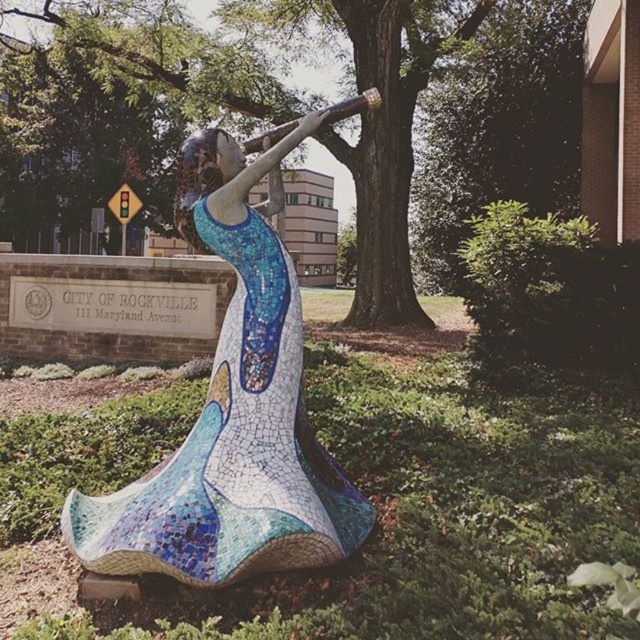
You are a visitor at the park and want to take a photo of the mosaic tile woman at center and the green leafy tree at center. Which object should you focus on first if you want to capture both in the same frame without moving the camera?

The mosaic tile woman at center is smaller than the green leafy tree at center, so you should focus on the green leafy tree at center first to ensure it fits properly in the frame.

You are a city planner assessing the space between the mosaic tile woman at center and the green leafy tree at center. If you want to install a bench that is 2 meters wide between them, will there be enough space?

The mosaic tile woman at center is narrower than the green leafy tree at center, but the description does not provide the exact distance between them. Therefore, it is impossible to determine if a 2 meter wide bench can fit between them based on the given information.

Based on the photo, you are standing in front of the sculpture and want to take a photo that includes both the mosaic tile woman at center and the green leafy tree at center. Which object should you position closer to the camera to ensure both are in focus?

To ensure both the mosaic tile woman at center and the green leafy tree at center are in focus, position the mosaic tile woman at center closer to the camera since it is already closer to the viewer than the tree. This way, the depth of field can cover both subjects effectively.